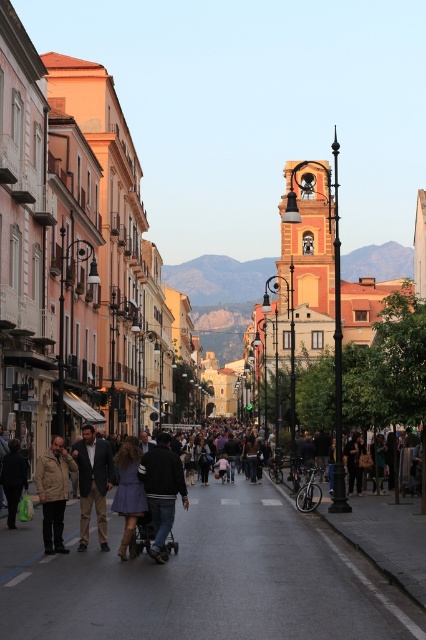
Can you confirm if gold metallic bell tower at center is taller than dark blue dress at center?

Yes, gold metallic bell tower at center is taller than dark blue dress at center.

In the scene shown: Who is taller, gold metallic bell tower at center or dark blue dress at center?

gold metallic bell tower at center is taller.

Who is more forward, (307, 177) or (380, 509)?

Point (380, 509) is in front.

Where is `gold metallic bell tower at center`? The width and height of the screenshot is (426, 640). gold metallic bell tower at center is located at coordinates coord(307,232).

From the picture: Who is positioned more to the right, dark blue jeans at center or khaki cotton pants at center?

From the viewer's perspective, dark blue jeans at center appears more on the right side.

Does dark blue jeans at center have a larger size compared to khaki cotton pants at center?

Incorrect, dark blue jeans at center is not larger than khaki cotton pants at center.

Who is more distant from viewer, (163, 448) or (100, 438)?

Positioned behind is point (100, 438).

Where is `dark blue jeans at center`? This screenshot has width=426, height=640. dark blue jeans at center is located at coordinates (161, 490).

Between dark blue dress at center and dark blue jeans at center, which one has less height?

With less height is dark blue jeans at center.

Can you confirm if dark blue dress at center is wider than dark blue jeans at center?

Correct, the width of dark blue dress at center exceeds that of dark blue jeans at center.

Between point (423, 548) and point (141, 468), which one is positioned in front?

Point (423, 548)

Identify the location of dark blue dress at center. This screenshot has width=426, height=640. (382, 524).